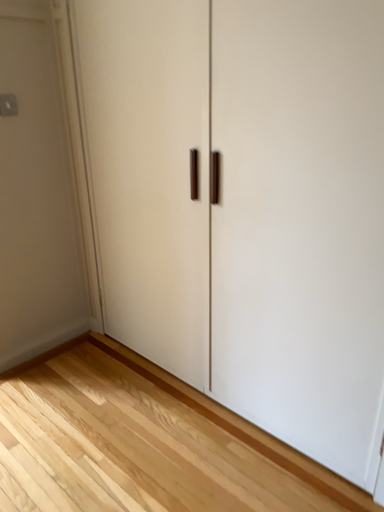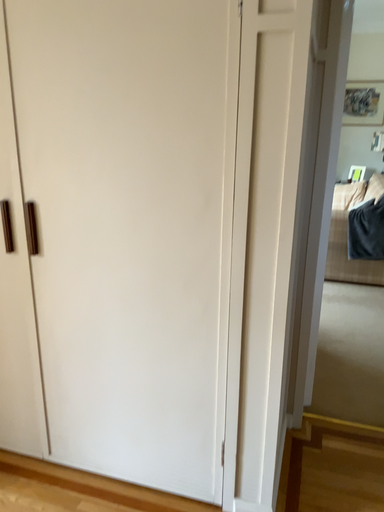
Question: Which way did the camera rotate in the video?

Choices:
 (A) rotated downward
 (B) rotated upward

Answer: (B)